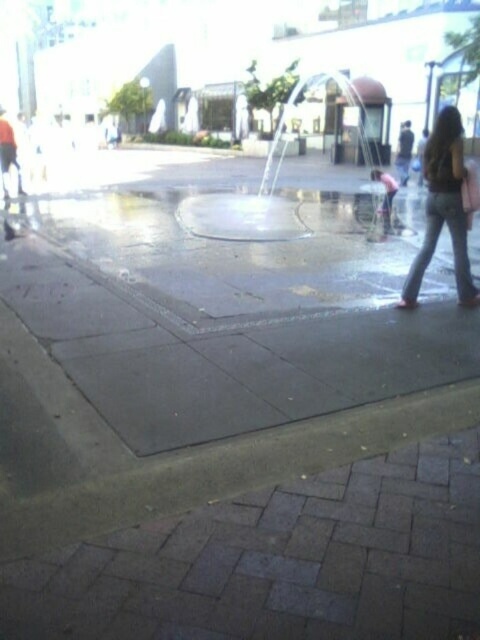
Looking at this image, you are a delivery person carrying a package that is 1.5 meters tall. You need to pass through the area near the transparent glass fountain at center and the denim jeans at right. Can your package fit vertically between them without hitting either object?

The transparent glass fountain at center is taller than the denim jeans at right. Since the package is 1.5 meters tall, it may not fit if the space between them is constrained by the fountain height. However, the exact vertical clearance isn

You are standing at the center of the sidewalk and want to reach the transparent glass fountain at center. Which direction should you walk to get there?

Since the transparent glass fountain at center is located at point (282, 164), you should walk towards the lower left direction from the center of the sidewalk to reach it.

You are a delivery person carrying a large package that is 1.5 meters wide. You need to pass through the area near the transparent glass fountain at center and the denim jeans at right. Can your package fit through the space between them?

The transparent glass fountain at center has a larger size compared to denim jeans at right. However, the exact distance between them isn not specified in the provided information. Without knowing the space between the two objects, it is impossible to determine if the package can fit through.